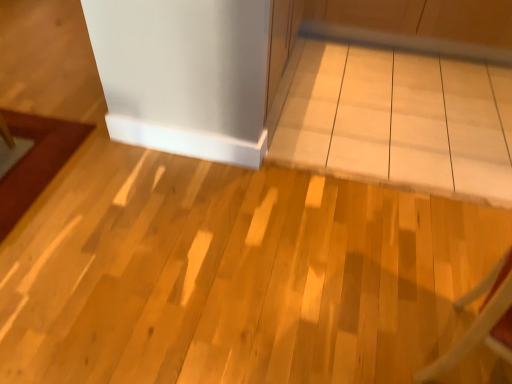
Question: From a real-world perspective, is white glossy table at center under wooden chair at lower right?

Choices:
 (A) yes
 (B) no

Answer: (A)

Question: Considering the relative sizes of white glossy table at center and wooden chair at lower right in the image provided, is white glossy table at center shorter than wooden chair at lower right?

Choices:
 (A) no
 (B) yes

Answer: (B)

Question: Is white glossy table at center wider than wooden chair at lower right?

Choices:
 (A) yes
 (B) no

Answer: (A)

Question: From the image's perspective, does white glossy table at center appear lower than wooden chair at lower right?

Choices:
 (A) yes
 (B) no

Answer: (B)

Question: Is white glossy table at center further to the viewer compared to wooden chair at lower right?

Choices:
 (A) no
 (B) yes

Answer: (B)

Question: Is white glossy table at center far from wooden chair at lower right?

Choices:
 (A) no
 (B) yes

Answer: (B)

Question: Is wooden chair at lower right wider than white glossy table at center?

Choices:
 (A) no
 (B) yes

Answer: (A)

Question: From a real-world perspective, is wooden chair at lower right on white glossy table at center?

Choices:
 (A) no
 (B) yes

Answer: (B)

Question: Considering the relative sizes of wooden chair at lower right and white glossy table at center in the image provided, is wooden chair at lower right shorter than white glossy table at center?

Choices:
 (A) yes
 (B) no

Answer: (B)

Question: Does wooden chair at lower right have a smaller size compared to white glossy table at center?

Choices:
 (A) yes
 (B) no

Answer: (A)

Question: Does wooden chair at lower right have a lesser width compared to white glossy table at center?

Choices:
 (A) no
 (B) yes

Answer: (B)

Question: Considering the relative positions of wooden chair at lower right and white glossy table at center in the image provided, is wooden chair at lower right to the right of white glossy table at center from the viewer's perspective?

Choices:
 (A) no
 (B) yes

Answer: (B)

Question: In the image, is wooden chair at lower right positioned in front of or behind white glossy table at center?

Choices:
 (A) behind
 (B) front

Answer: (B)